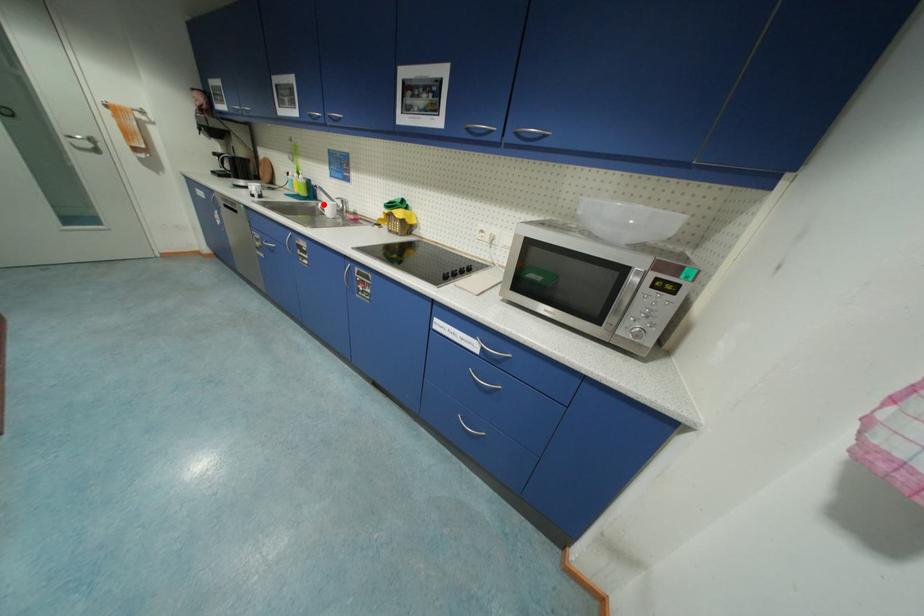
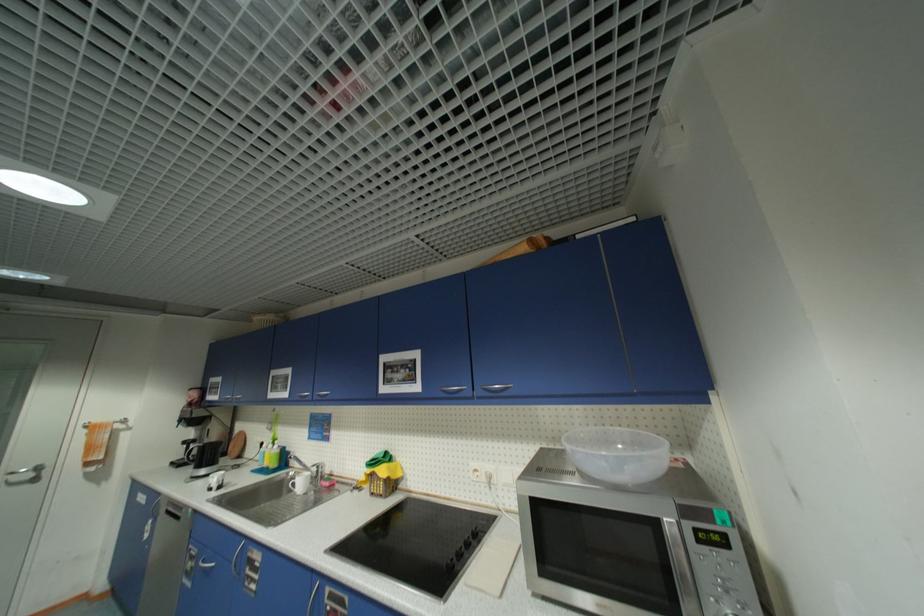
The point at the highlighted location is marked in the first image. Where is the corresponding point in the second image?

(294, 475)